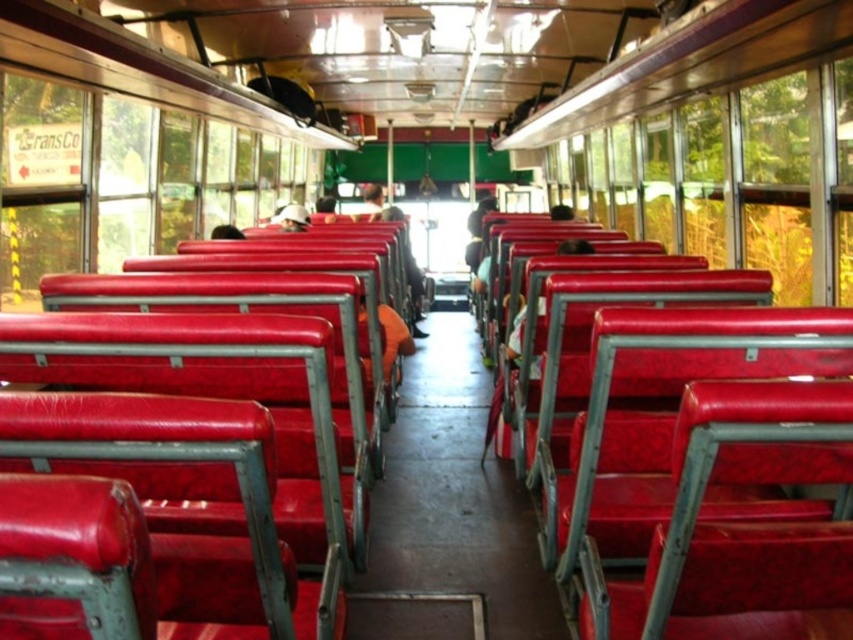
Question: Does matte red seats at center appear under matte red seat at center?

Choices:
 (A) no
 (B) yes

Answer: (A)

Question: Which point is farther to the camera?

Choices:
 (A) (126, 109)
 (B) (415, 280)

Answer: (B)

Question: Is matte red seats at center below matte red seat at center?

Choices:
 (A) no
 (B) yes

Answer: (A)

Question: Is matte red seats at center to the right of matte red seat at center from the viewer's perspective?

Choices:
 (A) no
 (B) yes

Answer: (A)

Question: Which point is closer to the camera?

Choices:
 (A) matte red seats at center
 (B) matte red seat at center

Answer: (A)

Question: Which object is farther from the camera taking this photo?

Choices:
 (A) matte red seats at center
 (B) matte red seat at center

Answer: (B)